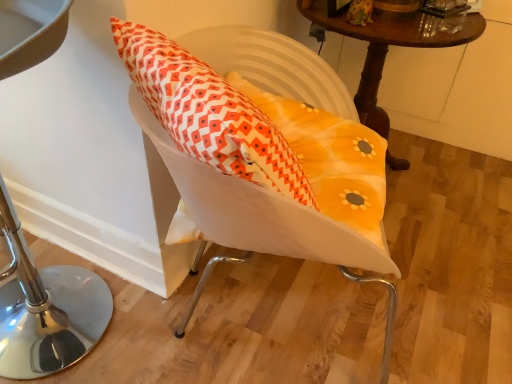
Question: Can you confirm if white fabric swivel chair at center is smaller than metallic stool at left?

Choices:
 (A) yes
 (B) no

Answer: (A)

Question: Is white fabric swivel chair at center positioned before metallic stool at left?

Choices:
 (A) yes
 (B) no

Answer: (A)

Question: Is white fabric swivel chair at center positioned behind metallic stool at left?

Choices:
 (A) no
 (B) yes

Answer: (A)

Question: Is white fabric swivel chair at center facing away from metallic stool at left?

Choices:
 (A) no
 (B) yes

Answer: (A)

Question: Is white fabric swivel chair at center at the right side of metallic stool at left?

Choices:
 (A) no
 (B) yes

Answer: (B)

Question: From a real-world perspective, is white fabric swivel chair at center located higher than metallic stool at left?

Choices:
 (A) yes
 (B) no

Answer: (A)

Question: From a real-world perspective, is metallic stool at left below white fabric swivel chair at center?

Choices:
 (A) yes
 (B) no

Answer: (A)

Question: Is metallic stool at left shorter than white fabric swivel chair at center?

Choices:
 (A) yes
 (B) no

Answer: (B)

Question: From a real-world perspective, is metallic stool at left on white fabric swivel chair at center?

Choices:
 (A) yes
 (B) no

Answer: (B)

Question: Does metallic stool at left appear on the right side of white fabric swivel chair at center?

Choices:
 (A) no
 (B) yes

Answer: (A)

Question: Does metallic stool at left have a larger size compared to white fabric swivel chair at center?

Choices:
 (A) yes
 (B) no

Answer: (A)

Question: Is metallic stool at left positioned behind white fabric swivel chair at center?

Choices:
 (A) no
 (B) yes

Answer: (B)

Question: Is wooden table at upper right positioned behind metallic stool at left?

Choices:
 (A) no
 (B) yes

Answer: (B)